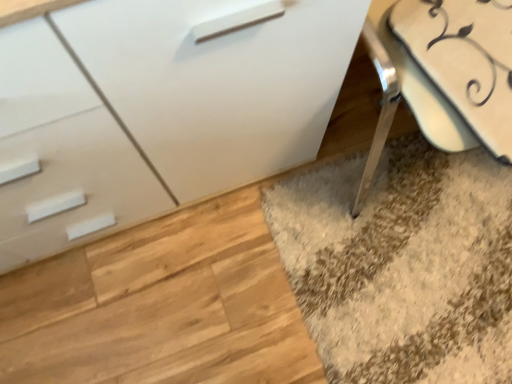
Question: Does white glossy chest of drawers at center have a greater width compared to white glossy swivel chair at lower right?

Choices:
 (A) yes
 (B) no

Answer: (B)

Question: Is white glossy chest of drawers at center oriented away from white glossy swivel chair at lower right?

Choices:
 (A) no
 (B) yes

Answer: (A)

Question: Is white glossy swivel chair at lower right completely or partially inside white glossy chest of drawers at center?

Choices:
 (A) no
 (B) yes

Answer: (A)

Question: Does white glossy chest of drawers at center have a lesser width compared to white glossy swivel chair at lower right?

Choices:
 (A) yes
 (B) no

Answer: (A)

Question: Does white glossy chest of drawers at center have a smaller size compared to white glossy swivel chair at lower right?

Choices:
 (A) no
 (B) yes

Answer: (A)

Question: Are white glossy chest of drawers at center and white glossy swivel chair at lower right located far from each other?

Choices:
 (A) yes
 (B) no

Answer: (B)

Question: Is white glossy swivel chair at lower right touching white glossy chest of drawers at center?

Choices:
 (A) no
 (B) yes

Answer: (A)

Question: Considering the relative sizes of white glossy swivel chair at lower right and white glossy chest of drawers at center in the image provided, is white glossy swivel chair at lower right shorter than white glossy chest of drawers at center?

Choices:
 (A) no
 (B) yes

Answer: (B)

Question: From the image's perspective, is white glossy swivel chair at lower right located beneath white glossy chest of drawers at center?

Choices:
 (A) no
 (B) yes

Answer: (A)

Question: From a real-world perspective, is white glossy swivel chair at lower right on top of white glossy chest of drawers at center?

Choices:
 (A) no
 (B) yes

Answer: (B)

Question: Would you say white glossy chest of drawers at center is part of white glossy swivel chair at lower right's contents?

Choices:
 (A) no
 (B) yes

Answer: (A)

Question: Is white glossy swivel chair at lower right to the right of white glossy chest of drawers at center from the viewer's perspective?

Choices:
 (A) yes
 (B) no

Answer: (A)

Question: Would you say white glossy swivel chair at lower right is to the left or to the right of white glossy chest of drawers at center in the picture?

Choices:
 (A) left
 (B) right

Answer: (B)